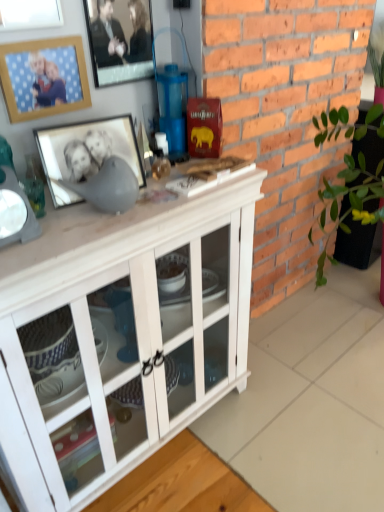
Measure the distance between brick at right and camera.

They are 1.21 meters apart.

Locate an element on the screen. wooden picture frame at upper left, the second picture frame from the bottom is located at coordinates (43, 77).

Considering the positions of objects wooden picture frame at upper left, the second picture frame from the bottom, and matte black picture frame at upper left, which is the 3th picture frame from top to bottom, in the image provided, who is more to the left, wooden picture frame at upper left, the second picture frame from the bottom, or matte black picture frame at upper left, which is the 3th picture frame from top to bottom,?

Positioned to the left is wooden picture frame at upper left, the second picture frame from the bottom.

Looking at this image, considering the sizes of objects wooden picture frame at upper left, the second picture frame from the bottom, and matte black picture frame at upper left, marked as the first picture frame in a bottom-to-top arrangement, in the image provided, who is wider, wooden picture frame at upper left, the second picture frame from the bottom, or matte black picture frame at upper left, marked as the first picture frame in a bottom-to-top arrangement,?

matte black picture frame at upper left, marked as the first picture frame in a bottom-to-top arrangement, is wider.

Can you confirm if wooden picture frame at upper left, the second picture frame from the bottom, is taller than matte black picture frame at upper left, marked as the first picture frame in a bottom-to-top arrangement?

Correct, wooden picture frame at upper left, the second picture frame from the bottom, is much taller as matte black picture frame at upper left, marked as the first picture frame in a bottom-to-top arrangement.

Is wooden picture frame at upper left, the second picture frame from the bottom, further to camera compared to matte black picture frame at upper left, marked as the first picture frame in a bottom-to-top arrangement?

That is True.

From the image's perspective, count 1st picture frames upward from the matte black picture frame at upper left, marked as the first picture frame in a bottom-to-top arrangement, and point to it. Please provide its 2D coordinates.

[(43, 77)]

Considering the points (97, 166) and (21, 97), which point is behind, point (97, 166) or point (21, 97)?

The point (21, 97) is behind.

From the image's perspective, which is below, matte black picture frame at upper left, which is the 3th picture frame from top to bottom, or wooden picture frame at upper left, arranged as the 2th picture frame when viewed from the top?

matte black picture frame at upper left, which is the 3th picture frame from top to bottom, appears lower in the image.

Is metallic silver picture frame at upper center, acting as the 1th picture frame starting from the top, in contact with white wood cabinet at center?

metallic silver picture frame at upper center, acting as the 1th picture frame starting from the top, is not next to white wood cabinet at center, and they're not touching.

From a real-world perspective, is metallic silver picture frame at upper center, acting as the 1th picture frame starting from the top, positioned above or below white wood cabinet at center?

Clearly, from a real-world perspective, metallic silver picture frame at upper center, acting as the 1th picture frame starting from the top, is above white wood cabinet at center.

Is metallic silver picture frame at upper center, arranged as the third picture frame when ordered from the bottom, inside or outside of white wood cabinet at center?

metallic silver picture frame at upper center, arranged as the third picture frame when ordered from the bottom, is outside white wood cabinet at center.

Who is shorter, brick at right or matte black picture frame at upper left, which is the 3th picture frame from top to bottom?

matte black picture frame at upper left, which is the 3th picture frame from top to bottom.

From a real-world perspective, is brick at right beneath matte black picture frame at upper left, which is the 3th picture frame from top to bottom?

Yes.

Between brick at right and matte black picture frame at upper left, which is the 3th picture frame from top to bottom, which one is positioned behind?

Positioned behind is brick at right.

Based on the photo, would you say brick at right is to the left or to the right of matte black picture frame at upper left, marked as the first picture frame in a bottom-to-top arrangement, in the picture?

brick at right is to the right of matte black picture frame at upper left, marked as the first picture frame in a bottom-to-top arrangement.

In the image, is wooden picture frame at upper left, arranged as the 2th picture frame when viewed from the top, on the left side or the right side of metallic silver picture frame at upper center, arranged as the third picture frame when ordered from the bottom?

wooden picture frame at upper left, arranged as the 2th picture frame when viewed from the top, is to the left of metallic silver picture frame at upper center, arranged as the third picture frame when ordered from the bottom.

Considering the points (54, 72) and (134, 19), which point is behind, point (54, 72) or point (134, 19)?

Positioned behind is point (134, 19).

From a real-world perspective, is wooden picture frame at upper left, the second picture frame from the bottom, below metallic silver picture frame at upper center, arranged as the third picture frame when ordered from the bottom?

Correct, in the physical world, wooden picture frame at upper left, the second picture frame from the bottom, is lower than metallic silver picture frame at upper center, arranged as the third picture frame when ordered from the bottom.

Considering the relative sizes of brick at right and metallic silver picture frame at upper center, arranged as the third picture frame when ordered from the bottom, in the image provided, is brick at right smaller than metallic silver picture frame at upper center, arranged as the third picture frame when ordered from the bottom,?

No, brick at right is not smaller than metallic silver picture frame at upper center, arranged as the third picture frame when ordered from the bottom.

Can you confirm if brick at right is wider than metallic silver picture frame at upper center, acting as the 1th picture frame starting from the top?

Indeed, brick at right has a greater width compared to metallic silver picture frame at upper center, acting as the 1th picture frame starting from the top.

Looking at this image, which is nearer, (251, 16) or (152, 69)?

Point (251, 16)

Consider the image. From a real-world perspective, is brick at right on metallic silver picture frame at upper center, acting as the 1th picture frame starting from the top?

Incorrect, from a real-world perspective, brick at right is lower than metallic silver picture frame at upper center, acting as the 1th picture frame starting from the top.

Which of these two, metallic silver picture frame at upper center, arranged as the third picture frame when ordered from the bottom, or matte black picture frame at upper left, which is the 3th picture frame from top to bottom, is wider?

Answer: Wider between the two is matte black picture frame at upper left, which is the 3th picture frame from top to bottom.

Is metallic silver picture frame at upper center, arranged as the third picture frame when ordered from the bottom, oriented towards matte black picture frame at upper left, which is the 3th picture frame from top to bottom?

No, metallic silver picture frame at upper center, arranged as the third picture frame when ordered from the bottom, is not facing towards matte black picture frame at upper left, which is the 3th picture frame from top to bottom.

Consider the image. Considering the relative positions of metallic silver picture frame at upper center, acting as the 1th picture frame starting from the top, and matte black picture frame at upper left, which is the 3th picture frame from top to bottom, in the image provided, is metallic silver picture frame at upper center, acting as the 1th picture frame starting from the top, to the right of matte black picture frame at upper left, which is the 3th picture frame from top to bottom, from the viewer's perspective?

Correct, you'll find metallic silver picture frame at upper center, acting as the 1th picture frame starting from the top, to the right of matte black picture frame at upper left, which is the 3th picture frame from top to bottom.

Where is `picture frame that is the 1st object to the left of the metallic silver picture frame at upper center, acting as the 1th picture frame starting from the top, starting at the anchor`? This screenshot has height=512, width=384. picture frame that is the 1st object to the left of the metallic silver picture frame at upper center, acting as the 1th picture frame starting from the top, starting at the anchor is located at coordinates (86, 153).

At what (x,y) coordinates should I click in order to perform the action: click on picture frame below the wooden picture frame at upper left, the second picture frame from the bottom (from a real-world perspective). Please return your answer as a coordinate pair (x, y). Image resolution: width=384 pixels, height=512 pixels. Looking at the image, I should click on (86, 153).

Where is `picture frame lying in front of the wooden picture frame at upper left, arranged as the 2th picture frame when viewed from the top`? This screenshot has width=384, height=512. picture frame lying in front of the wooden picture frame at upper left, arranged as the 2th picture frame when viewed from the top is located at coordinates (86, 153).

When comparing their distances from wooden picture frame at upper left, arranged as the 2th picture frame when viewed from the top, does metallic silver picture frame at upper center, arranged as the third picture frame when ordered from the bottom, or white wood cabinet at center seem closer?

The object closer to wooden picture frame at upper left, arranged as the 2th picture frame when viewed from the top, is metallic silver picture frame at upper center, arranged as the third picture frame when ordered from the bottom.

Estimate the real-world distances between objects in this image. Which object is further from white wood cabinet at center, matte black picture frame at upper left, which is the 3th picture frame from top to bottom, or brick at right?

brick at right is positioned further to the anchor white wood cabinet at center.

Looking at the image, which one is located further to brick at right, matte black picture frame at upper left, which is the 3th picture frame from top to bottom, or white wood cabinet at center?

Among the two, matte black picture frame at upper left, which is the 3th picture frame from top to bottom, is located further to brick at right.

From the image, which object appears to be farther from white wood cabinet at center, metallic silver picture frame at upper center, arranged as the third picture frame when ordered from the bottom, or matte black picture frame at upper left, which is the 3th picture frame from top to bottom?

Based on the image, metallic silver picture frame at upper center, arranged as the third picture frame when ordered from the bottom, appears to be further to white wood cabinet at center.

Looking at the image, which one is located closer to white wood cabinet at center, wooden picture frame at upper left, the second picture frame from the bottom, or matte black picture frame at upper left, which is the 3th picture frame from top to bottom?

matte black picture frame at upper left, which is the 3th picture frame from top to bottom, is positioned closer to the anchor white wood cabinet at center.

Based on their spatial positions, is metallic silver picture frame at upper center, acting as the 1th picture frame starting from the top, or wooden picture frame at upper left, the second picture frame from the bottom, further from matte black picture frame at upper left, marked as the first picture frame in a bottom-to-top arrangement?

metallic silver picture frame at upper center, acting as the 1th picture frame starting from the top, is positioned further to the anchor matte black picture frame at upper left, marked as the first picture frame in a bottom-to-top arrangement.

Which object lies further to the anchor point wooden picture frame at upper left, the second picture frame from the bottom, metallic silver picture frame at upper center, arranged as the third picture frame when ordered from the bottom, or matte black picture frame at upper left, marked as the first picture frame in a bottom-to-top arrangement?

Among the two, matte black picture frame at upper left, marked as the first picture frame in a bottom-to-top arrangement, is located further to wooden picture frame at upper left, the second picture frame from the bottom.

When comparing their distances from brick at right, does wooden picture frame at upper left, arranged as the 2th picture frame when viewed from the top, or metallic silver picture frame at upper center, acting as the 1th picture frame starting from the top, seem further?

wooden picture frame at upper left, arranged as the 2th picture frame when viewed from the top, lies further to brick at right than the other object.

This screenshot has height=512, width=384. Find the location of `picture frame situated between matte black picture frame at upper left, marked as the first picture frame in a bottom-to-top arrangement, and brick at right from left to right`. picture frame situated between matte black picture frame at upper left, marked as the first picture frame in a bottom-to-top arrangement, and brick at right from left to right is located at coordinates [119, 40].

The height and width of the screenshot is (512, 384). What are the coordinates of `picture frame located between white wood cabinet at center and brick at right in the left-right direction` in the screenshot? It's located at [x=119, y=40].

What are the coordinates of `cabinetry situated between matte black picture frame at upper left, marked as the first picture frame in a bottom-to-top arrangement, and brick at right from left to right` in the screenshot? It's located at (120, 334).

You are a GUI agent. You are given a task and a screenshot of the screen. Output one action in this format:
    pyautogui.click(x=<x>, y=<y>)
    Task: Click on the picture frame between wooden picture frame at upper left, arranged as the 2th picture frame when viewed from the top, and white wood cabinet at center from top to bottom
    Image resolution: width=384 pixels, height=512 pixels.
    Given the screenshot: What is the action you would take?
    pyautogui.click(x=86, y=153)